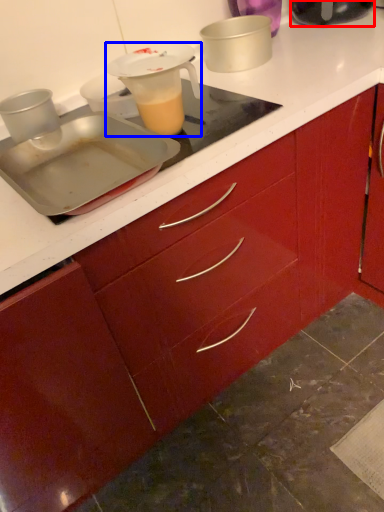
Question: Which object appears farthest to the camera in this image, kitchen appliance (highlighted by a red box) or jug (highlighted by a blue box)?

Choices:
 (A) kitchen appliance
 (B) jug

Answer: (A)